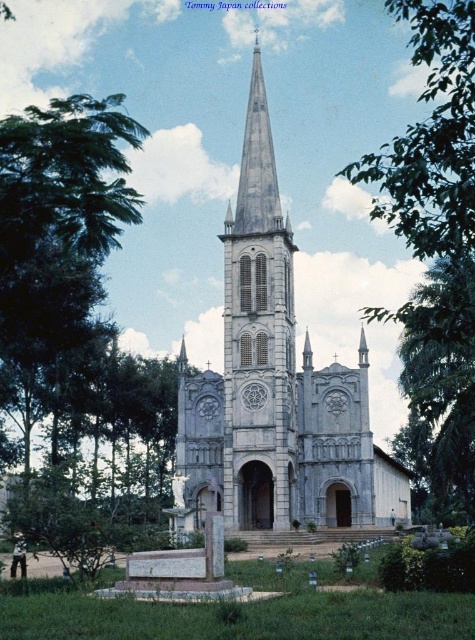
You are standing in front of the church and want to take a photo that includes both the white stone tower at center and the green leafy tree at upper right. Which one should you zoom in on more to ensure both fit in the frame?

The white stone tower at center is smaller than the green leafy tree at upper right, so you should zoom in more on the green leafy tree at upper right to ensure both fit in the frame.

You are standing in front of the church and want to take a photo that includes both the green leafy tree at upper right and the green leafy tree at right. Which tree should you position closer to the top of the frame to include both in your photo?

To include both the green leafy tree at upper right and the green leafy tree at right in the photo, position the green leafy tree at upper right closer to the top of the frame since it is located above the green leafy tree at right.

You are standing in front of the white stone church at center and want to take a photo of the green leafy tree at upper right. Which object should you focus on first to ensure both are in the frame?

You should focus on the white stone church at center first because it is closer to you than the green leafy tree at upper right, so it will appear larger in the photo. To include both in the frame, you need to adjust your camera angle to capture the distant tree while keeping the church in view.